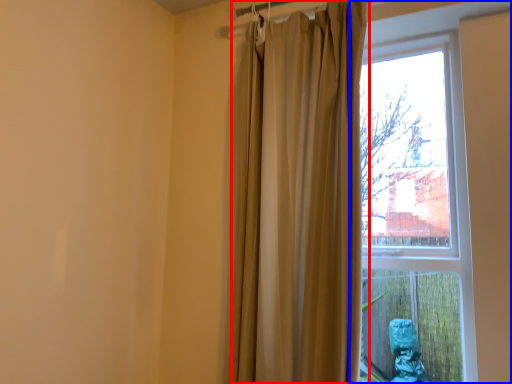
Question: Which point is further to the camera, curtain (highlighted by a red box) or window (highlighted by a blue box)?

Choices:
 (A) curtain
 (B) window

Answer: (A)